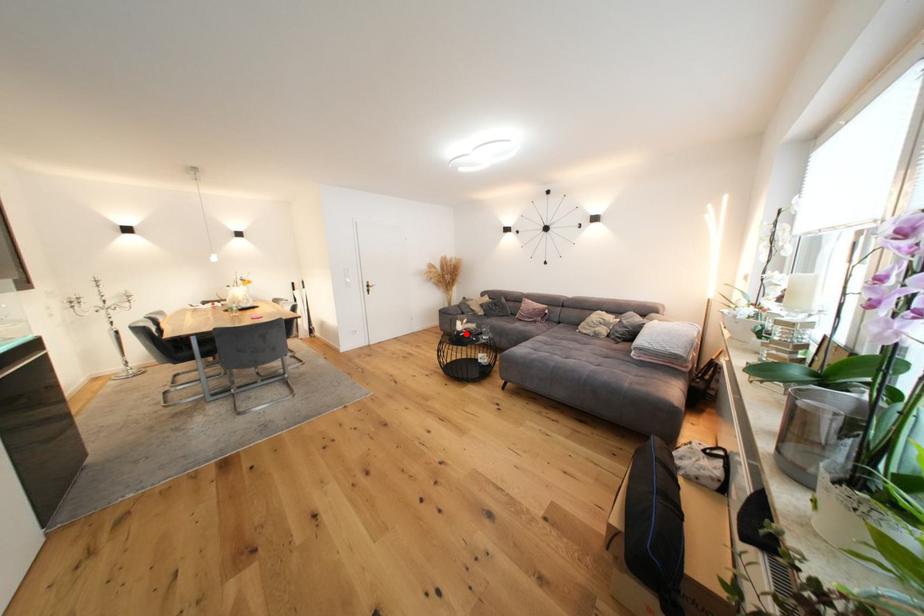
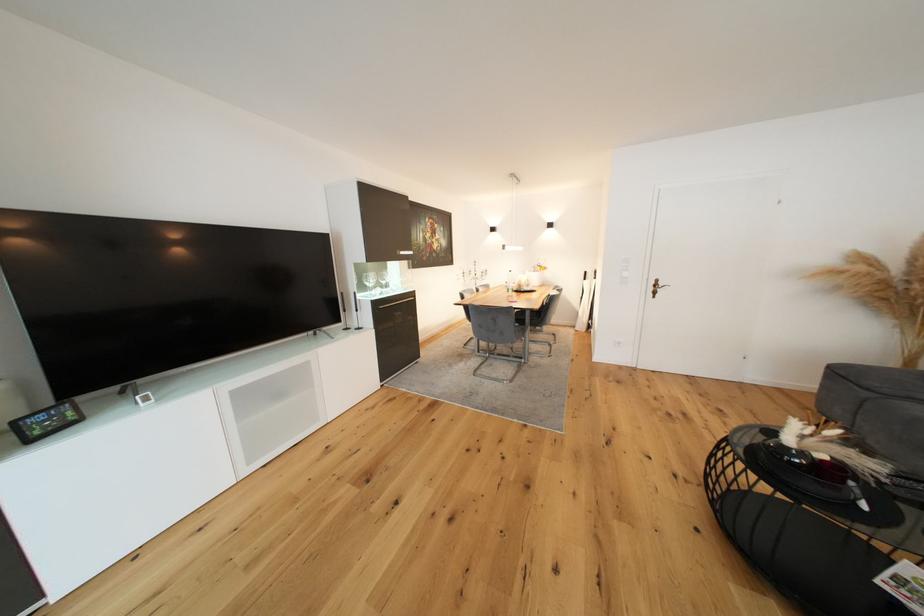
In the second image, find the point that corresponds to the highlighted location in the first image.

(792, 450)